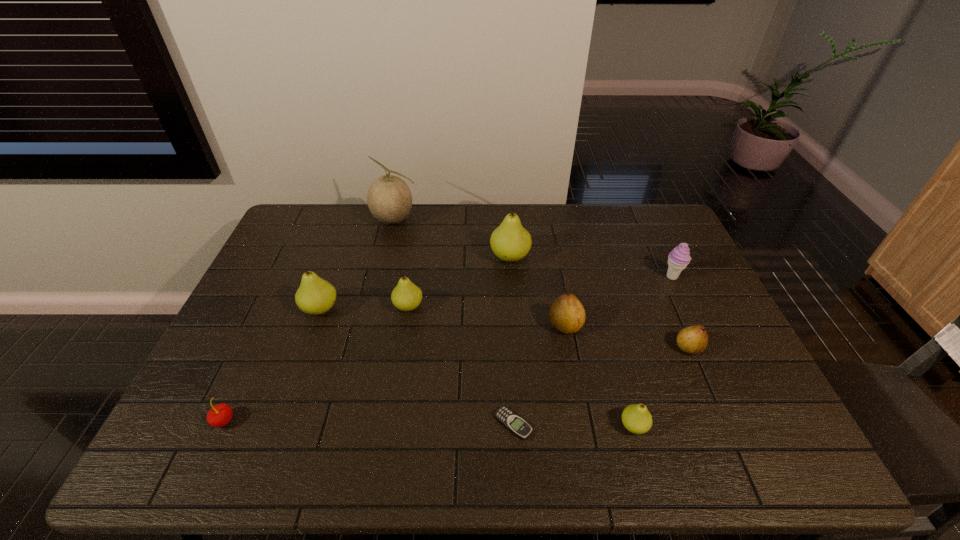
The image size is (960, 540). I want to click on cherry positioned at the near edge, so click(x=221, y=414).

Image resolution: width=960 pixels, height=540 pixels. I want to click on beeper present at the near edge, so click(513, 422).

Locate an element on the screen. This screenshot has height=540, width=960. object located at the left edge is located at coordinates (221, 414).

You are a GUI agent. You are given a task and a screenshot of the screen. Output one action in this format:
    pyautogui.click(x=<x>, y=<y>)
    Task: Click on the icecream that is at the right edge
    Image resolution: width=960 pixels, height=540 pixels.
    Given the screenshot: What is the action you would take?
    pyautogui.click(x=679, y=258)

The width and height of the screenshot is (960, 540). Identify the location of pear that is at the right edge. (694, 339).

The height and width of the screenshot is (540, 960). What are the coordinates of `object present at the near left corner` in the screenshot? It's located at (221, 414).

Where is `blank area at the far edge`? The height and width of the screenshot is (540, 960). blank area at the far edge is located at coordinates (494, 207).

Find the location of a particular element. The height and width of the screenshot is (540, 960). vacant space at the left edge of the desktop is located at coordinates (196, 392).

Where is `free spot at the right edge of the desktop`? Image resolution: width=960 pixels, height=540 pixels. free spot at the right edge of the desktop is located at coordinates (723, 411).

I want to click on vacant space at the far left corner, so click(x=294, y=224).